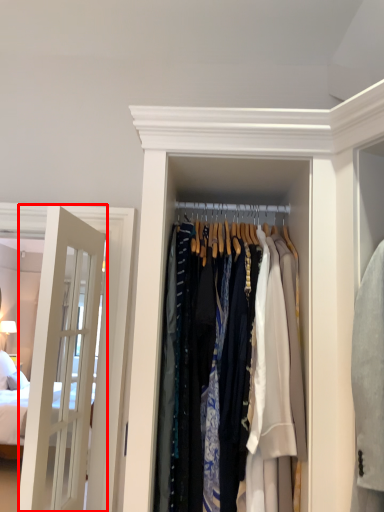
Question: From the image's perspective, where is door (annotated by the red box) located relative to closet?

Choices:
 (A) below
 (B) above

Answer: (A)